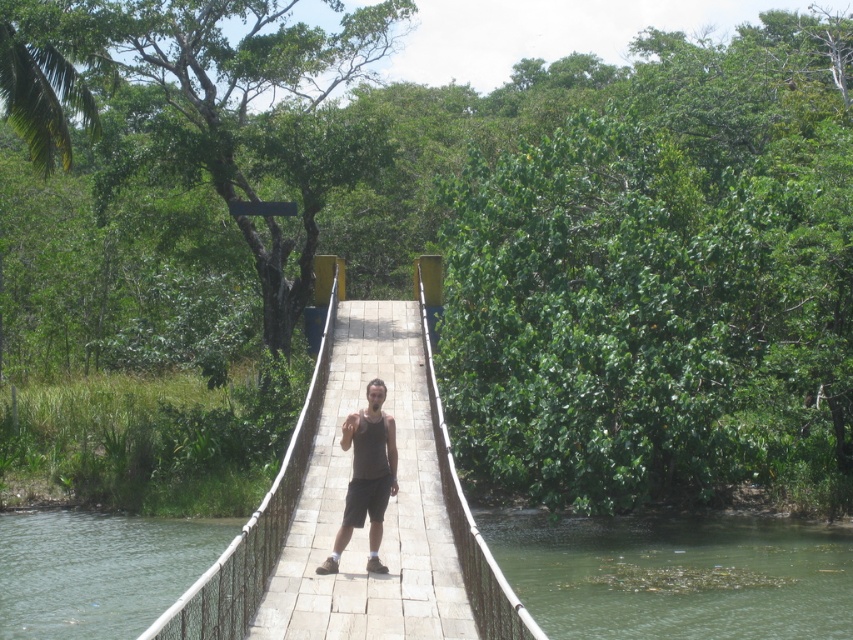
You are a hiker who just arrived at the suspension bridge. You see the green murky water at lower center and the dark gray tank top at center. Which object is located lower in the image?

The green murky water at lower center is located lower than the dark gray tank top at center in the image.

Looking at this image, you are a hiker standing on the suspension bridge and want to cross to the other side. There is a point marked at coordinates (676, 576). Is this point on the green murky water at center?

The green murky water at center is located at point (676, 576), so yes, the point is on the green murky water at center.

You are a hiker who wants to know if the green water at lower left is higher or lower than the dark gray tank top at center in the image. Can you help?

The green water at lower left is not as tall as dark gray tank top at center, so the green water at lower left is lower than the dark gray tank top at center.